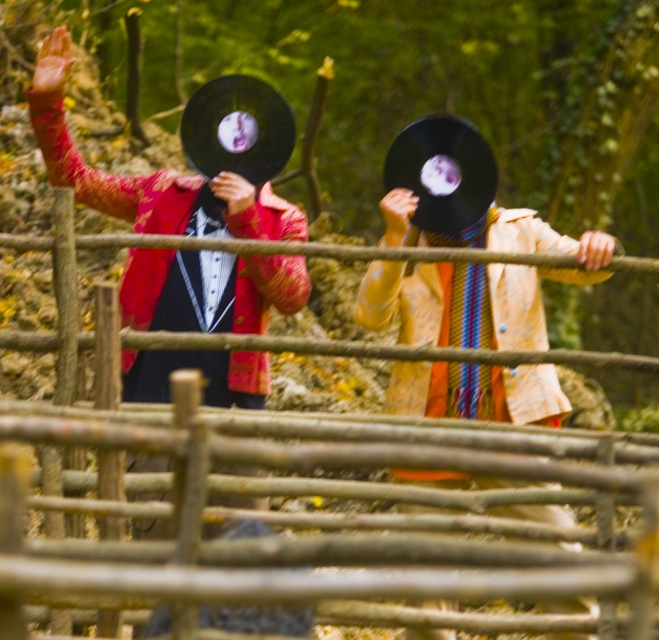
Question: Which object is closer to the camera taking this photo?

Choices:
 (A) wooden at center
 (B) matte black vinyl record at left

Answer: (A)

Question: Does wooden at center have a smaller size compared to matte black vinyl record at left?

Choices:
 (A) yes
 (B) no

Answer: (B)

Question: Is wooden at center below matte black vinyl record at left?

Choices:
 (A) yes
 (B) no

Answer: (A)

Question: Which point is closer to the camera?

Choices:
 (A) (140, 193)
 (B) (229, 588)

Answer: (B)

Question: Which point appears farthest from the camera in this image?

Choices:
 (A) (559, 492)
 (B) (268, 381)

Answer: (B)

Question: Is wooden at center closer to the viewer compared to matte black vinyl record at left?

Choices:
 (A) yes
 (B) no

Answer: (A)